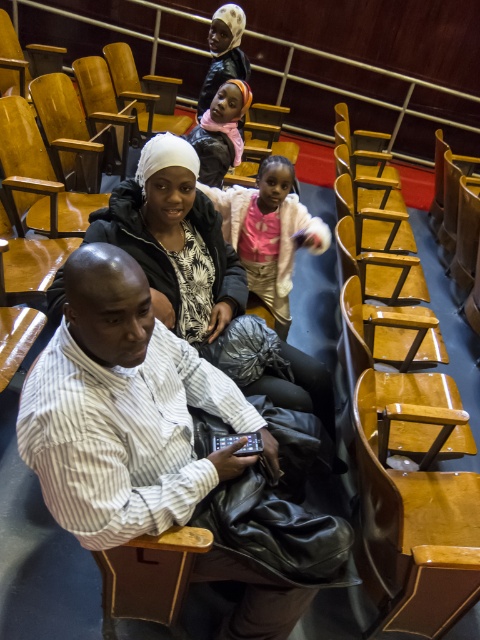
Does wooden polished chair at lower right have a lesser height compared to matte black jacket at center?

Indeed, wooden polished chair at lower right has a lesser height compared to matte black jacket at center.

Is wooden polished chair at lower right to the right of matte black jacket at center from the viewer's perspective?

Correct, you'll find wooden polished chair at lower right to the right of matte black jacket at center.

Identify the location of wooden polished chair at lower right. (414, 525).

Is matte black jacket at center thinner than pink fleece jacket at center?

Incorrect, matte black jacket at center's width is not less than pink fleece jacket at center's.

Identify the location of matte black jacket at center. (175, 241).

Find the location of a particular element. The image size is (480, 640). matte black jacket at center is located at coordinates (175, 241).

Between striped cotton shirt at center and pink fleece jacket at center, which one appears on the left side from the viewer's perspective?

From the viewer's perspective, striped cotton shirt at center appears more on the left side.

Which is behind, point (107, 435) or point (261, 273)?

The point (261, 273) is behind.

Find the location of a particular element. striped cotton shirt at center is located at coordinates (124, 410).